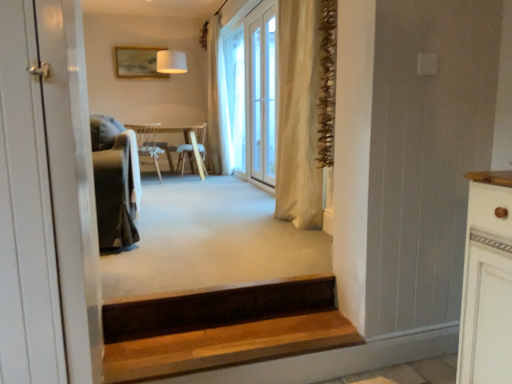
Question: Is wooden chair at center, which appears as the second chair when viewed from the back, shorter than beige fabric curtain at center, the 1th curtain from the right?

Choices:
 (A) no
 (B) yes

Answer: (B)

Question: Is wooden chair at center, which appears as the second chair when viewed from the back, smaller than beige fabric curtain at center, placed as the 2th curtain when sorted from left to right?

Choices:
 (A) yes
 (B) no

Answer: (A)

Question: Is wooden chair at center, placed as the first chair when sorted from front to back, positioned with its back to beige fabric curtain at center, the first curtain in the front-to-back sequence?

Choices:
 (A) no
 (B) yes

Answer: (B)

Question: Considering the relative sizes of wooden chair at center, placed as the first chair when sorted from front to back, and beige fabric curtain at center, the first curtain in the front-to-back sequence, in the image provided, is wooden chair at center, placed as the first chair when sorted from front to back, taller than beige fabric curtain at center, the first curtain in the front-to-back sequence,?

Choices:
 (A) no
 (B) yes

Answer: (A)

Question: From a real-world perspective, is wooden chair at center, which appears as the second chair when viewed from the back, positioned under beige fabric curtain at center, the 1th curtain from the right, based on gravity?

Choices:
 (A) no
 (B) yes

Answer: (B)

Question: In terms of width, does white wood door at left look wider or thinner when compared to wooden stairs at lower center?

Choices:
 (A) wide
 (B) thin

Answer: (B)

Question: Relative to wooden stairs at lower center, is white wood door at left in front or behind?

Choices:
 (A) behind
 (B) front

Answer: (B)

Question: From the image's perspective, is white wood door at left located above or below wooden stairs at lower center?

Choices:
 (A) above
 (B) below

Answer: (A)

Question: Is white wood door at left inside or outside of wooden stairs at lower center?

Choices:
 (A) inside
 (B) outside

Answer: (B)

Question: In terms of size, does white wood door at left appear bigger or smaller than wooden chair at center, placed as the first chair when sorted from front to back?

Choices:
 (A) big
 (B) small

Answer: (B)

Question: Choose the correct answer: Is white wood door at left inside wooden chair at center, placed as the first chair when sorted from front to back, or outside it?

Choices:
 (A) outside
 (B) inside

Answer: (A)

Question: From the image's perspective, is white wood door at left above or below wooden chair at center, which appears as the second chair when viewed from the back?

Choices:
 (A) above
 (B) below

Answer: (B)

Question: Is white wood door at left to the left or to the right of wooden chair at center, placed as the first chair when sorted from front to back, in the image?

Choices:
 (A) left
 (B) right

Answer: (B)

Question: From a real-world perspective, is beige fabric curtain at center, the 2th curtain in the right-to-left sequence, above or below wooden chair at center, which appears as the second chair when viewed from the back?

Choices:
 (A) below
 (B) above

Answer: (B)

Question: In terms of height, does beige fabric curtain at center, the 1th curtain when ordered from left to right, look taller or shorter compared to wooden chair at center, which appears as the second chair when viewed from the back?

Choices:
 (A) tall
 (B) short

Answer: (A)